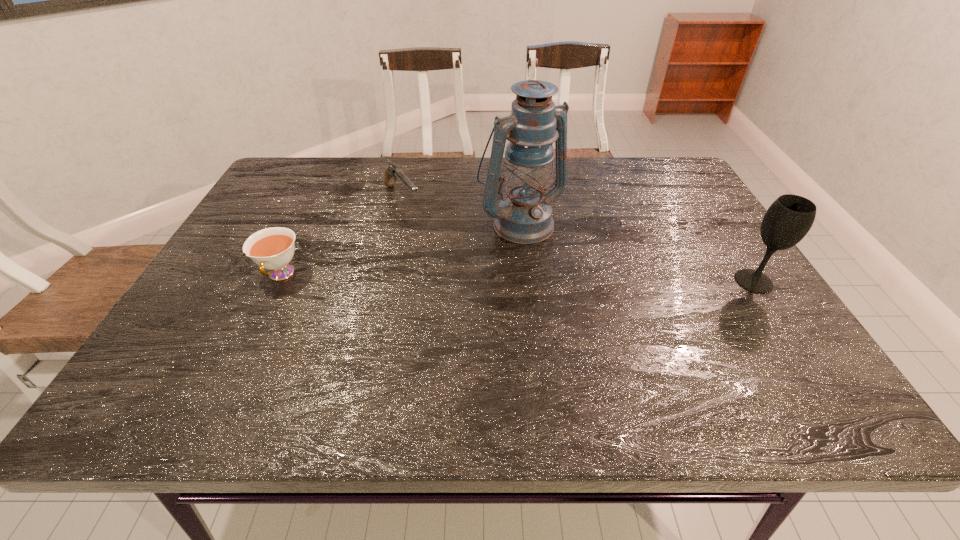
I want to click on free space on the desktop that is between the leftmost object and the third shortest object and is positioned on the front-facing side of the lantern, so pos(577,279).

Locate an element on the screen. This screenshot has width=960, height=540. free spot on the desktop that is between the teacup and the rightmost object and is positioned aiming along the barrel of the second object from left to right is located at coordinates (470, 278).